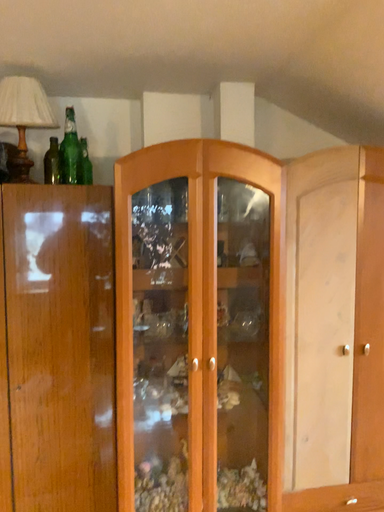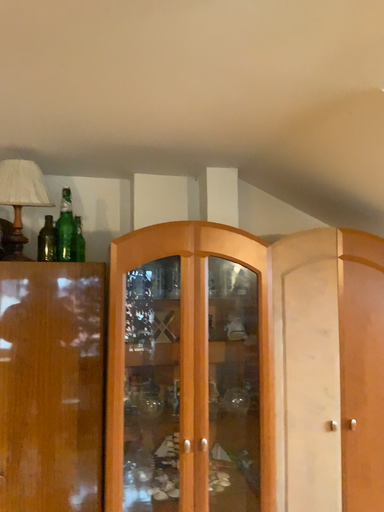
Question: Which way did the camera rotate in the video?

Choices:
 (A) rotated downward
 (B) rotated upward

Answer: (B)